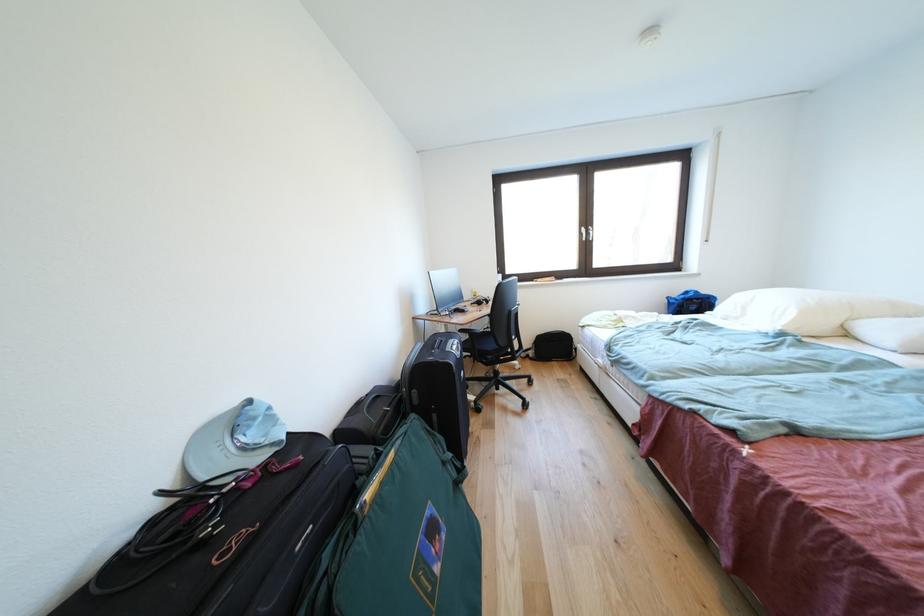
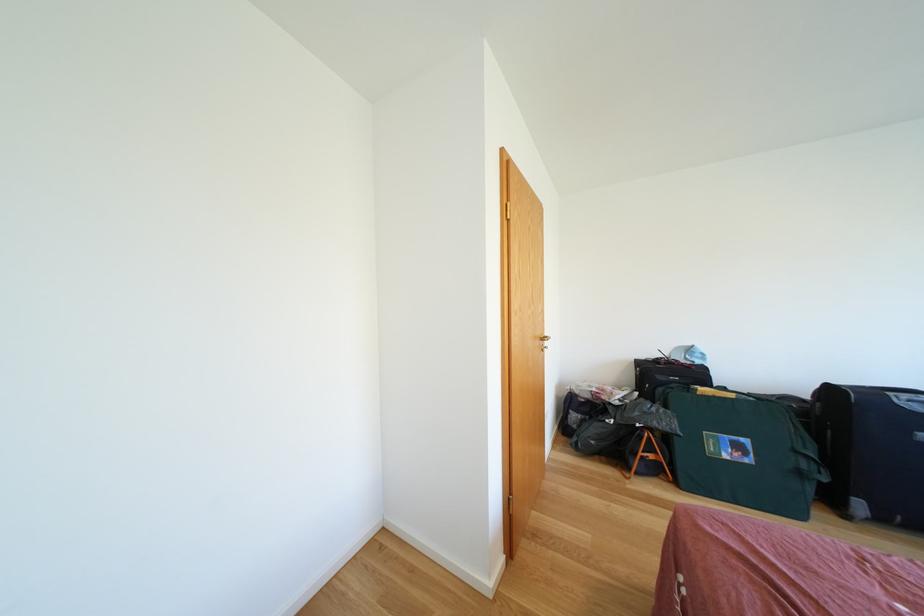
In the second image, find the point that corresponds to (x=400, y=460) in the first image.

(739, 400)